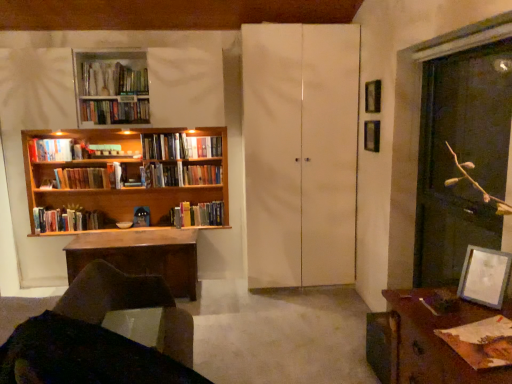
At what (x,y) coordinates should I click in order to perform the action: click on hardcover books at upper left, marked as the third book in a front-to-back arrangement. Please return your answer as a coordinate pair (x, y). The image size is (512, 384). Looking at the image, I should click on (114, 111).

What is the approximate height of brown leather chair at lower left?

32.21 inches.

The height and width of the screenshot is (384, 512). What do you see at coordinates (104, 335) in the screenshot? I see `brown leather chair at lower left` at bounding box center [104, 335].

The width and height of the screenshot is (512, 384). Identify the location of hardcover book at center, the 8th book viewed from the front. (203, 147).

This screenshot has width=512, height=384. What are the coordinates of `metallic silver picture frame at upper right, which appears as the third picture frame when ordered from the bottom` in the screenshot? It's located at (373, 96).

Where is `metallic silver picture frame at upper right, marked as the 2th picture frame in a top-to-bottom arrangement`? Image resolution: width=512 pixels, height=384 pixels. metallic silver picture frame at upper right, marked as the 2th picture frame in a top-to-bottom arrangement is located at coordinates (372, 136).

Describe the element at coordinates (51, 150) in the screenshot. Image resolution: width=512 pixels, height=384 pixels. I see `hardcover book at upper left, arranged as the 4th book when viewed from the front` at that location.

The image size is (512, 384). What do you see at coordinates (141, 255) in the screenshot?
I see `wooden desk at left` at bounding box center [141, 255].

Find the location of a particular element. The height and width of the screenshot is (384, 512). wooden desk at left is located at coordinates (141, 255).

Measure the distance between point [187,167] and camera.

They are 13.30 feet apart.

You are a GUI agent. You are given a task and a screenshot of the screen. Output one action in this format:
    pyautogui.click(x=<x>, y=<y>)
    Task: Click on the hardcover books at upper left, which is the 7th book in back-to-front order
    Image resolution: width=512 pixels, height=384 pixels.
    Given the screenshot: What is the action you would take?
    pyautogui.click(x=114, y=111)

Considering the relative positions of wooden bookshelf at center, the ninth book positioned from the front, and metallic silver picture frame at upper right, acting as the first picture frame starting from the top, in the image provided, is wooden bookshelf at center, the ninth book positioned from the front, behind metallic silver picture frame at upper right, acting as the first picture frame starting from the top,?

Yes, it is behind metallic silver picture frame at upper right, acting as the first picture frame starting from the top.

At what (x,y) coordinates should I click in order to perform the action: click on the 2nd picture frame in front of the wooden bookshelf at center, which is counted as the 1th book, starting from the back, counting from the anchor's position. Please return your answer as a coordinate pair (x, y). The width and height of the screenshot is (512, 384). Looking at the image, I should click on (373, 96).

Could you tell me if wooden bookshelf at center, the ninth book positioned from the front, is turned towards metallic silver picture frame at upper right, placed as the 2th picture frame when sorted from front to back?

No, wooden bookshelf at center, the ninth book positioned from the front, is not oriented towards metallic silver picture frame at upper right, placed as the 2th picture frame when sorted from front to back.

From the image's perspective, is metallic silver picture frame at upper right, which appears as the third picture frame when ordered from the bottom, above or below matte white picture frame at lower right, which is the 1th picture frame in front-to-back order?

Clearly, from the image's perspective, metallic silver picture frame at upper right, which appears as the third picture frame when ordered from the bottom, is above matte white picture frame at lower right, which is the 1th picture frame in front-to-back order.

From a real-world perspective, is metallic silver picture frame at upper right, the second picture frame in the back-to-front sequence, beneath matte white picture frame at lower right, arranged as the 1th picture frame when ordered from the bottom?

No.

Considering the relative sizes of metallic silver picture frame at upper right, the second picture frame in the back-to-front sequence, and matte white picture frame at lower right, which is the third picture frame in top-to-bottom order, in the image provided, is metallic silver picture frame at upper right, the second picture frame in the back-to-front sequence, taller than matte white picture frame at lower right, which is the third picture frame in top-to-bottom order,?

Yes, metallic silver picture frame at upper right, the second picture frame in the back-to-front sequence, is taller than matte white picture frame at lower right, which is the third picture frame in top-to-bottom order.

Are white matte cabinet at center, which is the 2th screen door from right to left, and brown wooden desk at lower right beside each other?

No, white matte cabinet at center, which is the 2th screen door from right to left, is not making contact with brown wooden desk at lower right.

Measure the distance from white matte cabinet at center, which is the 2th screen door from right to left, to brown wooden desk at lower right.

The distance of white matte cabinet at center, which is the 2th screen door from right to left, from brown wooden desk at lower right is 6.91 feet.

From a real-world perspective, is white matte cabinet at center, positioned as the first screen door in left-to-right order, over brown wooden desk at lower right?

Yes, from a real-world perspective, white matte cabinet at center, positioned as the first screen door in left-to-right order, is over brown wooden desk at lower right

Is matte brown book at lower right, the 9th book positioned from the back, touching brown leather chair at lower left?

No, matte brown book at lower right, the 9th book positioned from the back, is not next to brown leather chair at lower left.

From a real-world perspective, is matte brown book at lower right, the first book in the front-to-back sequence, positioned under brown leather chair at lower left based on gravity?

No.

In terms of size, does metallic silver picture frame at upper right, the second picture frame in the back-to-front sequence, appear bigger or smaller than wooden spoon at upper left, the 8th book in the back-to-front sequence?

In the image, metallic silver picture frame at upper right, the second picture frame in the back-to-front sequence, appears to be smaller than wooden spoon at upper left, the 8th book in the back-to-front sequence.

Which is correct: metallic silver picture frame at upper right, the second picture frame in the back-to-front sequence, is inside wooden spoon at upper left, the 8th book in the back-to-front sequence, or outside of it?

metallic silver picture frame at upper right, the second picture frame in the back-to-front sequence, is outside wooden spoon at upper left, the 8th book in the back-to-front sequence.

Consider the image. Which object is more forward, metallic silver picture frame at upper right, which appears as the third picture frame when ordered from the bottom, or wooden spoon at upper left, the 8th book in the back-to-front sequence?

metallic silver picture frame at upper right, which appears as the third picture frame when ordered from the bottom.

Is hardcover books at left, arranged as the 5th book when viewed from the back, wider or thinner than white matte cabinet at center, positioned as the first screen door in left-to-right order?

Clearly, hardcover books at left, arranged as the 5th book when viewed from the back, has less width compared to white matte cabinet at center, positioned as the first screen door in left-to-right order.

Considering the points (83, 174) and (290, 247), which point is behind, point (83, 174) or point (290, 247)?

The point (83, 174) is more distant.

Is hardcover books at left, which is counted as the 5th book, starting from the front, not near white matte cabinet at center, marked as the second screen door in a front-to-back arrangement?

Yes.

Considering the relative sizes of transparent glass screen door at right, arranged as the first screen door when viewed from the right, and metallic silver picture frame at upper right, the second picture frame in the back-to-front sequence, in the image provided, is transparent glass screen door at right, arranged as the first screen door when viewed from the right, bigger than metallic silver picture frame at upper right, the second picture frame in the back-to-front sequence,?

Correct, transparent glass screen door at right, arranged as the first screen door when viewed from the right, is larger in size than metallic silver picture frame at upper right, the second picture frame in the back-to-front sequence.

Considering the sizes of objects transparent glass screen door at right, marked as the second screen door in a back-to-front arrangement, and metallic silver picture frame at upper right, acting as the first picture frame starting from the top, in the image provided, who is thinner, transparent glass screen door at right, marked as the second screen door in a back-to-front arrangement, or metallic silver picture frame at upper right, acting as the first picture frame starting from the top,?

Thinner between the two is metallic silver picture frame at upper right, acting as the first picture frame starting from the top.

From a real-world perspective, is transparent glass screen door at right, arranged as the first screen door when viewed from the right, over metallic silver picture frame at upper right, placed as the 2th picture frame when sorted from front to back?

No, from a real-world perspective, transparent glass screen door at right, arranged as the first screen door when viewed from the right, is not on top of metallic silver picture frame at upper right, placed as the 2th picture frame when sorted from front to back.

Does point (475, 113) come closer to viewer compared to point (367, 100)?

No, (475, 113) is further to viewer.

The image size is (512, 384). Find the location of `the 2nd picture frame above the wooden bookshelf at center, which is counted as the 1th book, starting from the back (from a real-world perspective)`. the 2nd picture frame above the wooden bookshelf at center, which is counted as the 1th book, starting from the back (from a real-world perspective) is located at coordinates [x=373, y=96].

Where is `picture frame that is the 2nd object to the right of the metallic silver picture frame at upper right, the second picture frame in the back-to-front sequence, starting at the anchor`? This screenshot has height=384, width=512. picture frame that is the 2nd object to the right of the metallic silver picture frame at upper right, the second picture frame in the back-to-front sequence, starting at the anchor is located at coordinates (485, 276).

Considering their positions, is white matte cabinet at center, which is the 2th screen door from right to left, positioned closer to brown wooden desk at lower right than hardcover book at center, the 8th book viewed from the front?

Among the two, white matte cabinet at center, which is the 2th screen door from right to left, is located nearer to brown wooden desk at lower right.

Estimate the real-world distances between objects in this image. Which object is further from hardcover books at center, which appears as the 6th book when viewed from the front, metallic silver picture frame at upper right, marked as the 2th picture frame in a top-to-bottom arrangement, or matte white picture frame at lower right, which is the third picture frame in top-to-bottom order?

Based on the image, matte white picture frame at lower right, which is the third picture frame in top-to-bottom order, appears to be further to hardcover books at center, which appears as the 6th book when viewed from the front.

Which object lies further to the anchor point metallic silver picture frame at upper right, the second picture frame in the back-to-front sequence, wooden spoon at upper left, the 2th book viewed from the front, or wooden desk at left?

The object further to metallic silver picture frame at upper right, the second picture frame in the back-to-front sequence, is wooden desk at left.

Based on their spatial positions, is wooden desk at left or hardcover books at left, placed as the 7th book when sorted from front to back, closer to transparent glass screen door at right, which ranks as the 2th screen door in left-to-right order?

wooden desk at left.

Which object lies nearer to the anchor point hardcover book at upper left, arranged as the 6th book when viewed from the back, hardcover books at center, the fourth book from the back, or hardcover book at center, which ranks as the second book in back-to-front order?

hardcover books at center, the fourth book from the back, is closer to hardcover book at upper left, arranged as the 6th book when viewed from the back.

Which object lies nearer to the anchor point wooden bookshelf at center, the ninth book positioned from the front, hardcover books at center, the fourth book from the back, or brown leather chair at lower left?

hardcover books at center, the fourth book from the back, is closer to wooden bookshelf at center, the ninth book positioned from the front.

Estimate the real-world distances between objects in this image. Which object is further from hardcover books at center, which appears as the 6th book when viewed from the front, metallic silver picture frame at upper right, which appears as the third picture frame when ordered from the bottom, or hardcover books at upper left, marked as the third book in a front-to-back arrangement?

Among the two, metallic silver picture frame at upper right, which appears as the third picture frame when ordered from the bottom, is located further to hardcover books at center, which appears as the 6th book when viewed from the front.

Based on their spatial positions, is wooden bookcase at left or matte white picture frame at lower right, arranged as the 1th picture frame when ordered from the bottom, further from wooden desk at left?

Based on the image, matte white picture frame at lower right, arranged as the 1th picture frame when ordered from the bottom, appears to be further to wooden desk at left.

This screenshot has height=384, width=512. I want to click on picture frame between matte brown book at lower right, the 9th book positioned from the back, and transparent glass screen door at right, which ranks as the 2th screen door in left-to-right order, from front to back, so click(485, 276).

At what (x,y) coordinates should I click in order to perform the action: click on screen door between transparent glass screen door at right, which ranks as the 2th screen door in left-to-right order, and hardcover book at center, which ranks as the second book in back-to-front order, along the z-axis. Please return your answer as a coordinate pair (x, y). Image resolution: width=512 pixels, height=384 pixels. Looking at the image, I should click on (300, 152).

The height and width of the screenshot is (384, 512). I want to click on chair positioned between brown wooden desk at lower right and wooden desk at left from near to far, so click(104, 335).

I want to click on bookcase between hardcover book at upper left, arranged as the 6th book when viewed from the back, and metallic silver picture frame at upper right, acting as the first picture frame starting from the top, so click(121, 178).